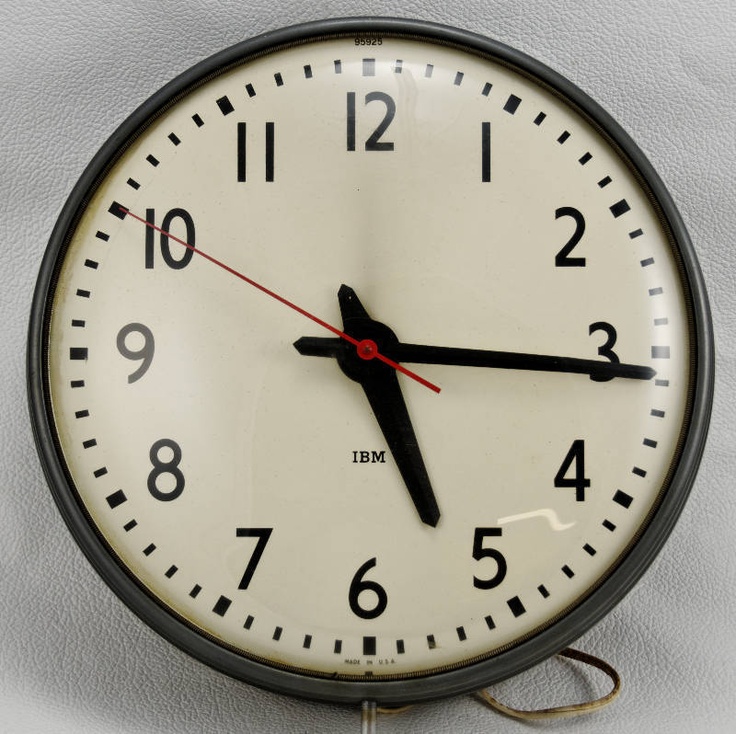
Where is `white clock face`? The image size is (736, 734). white clock face is located at coordinates (227, 392).